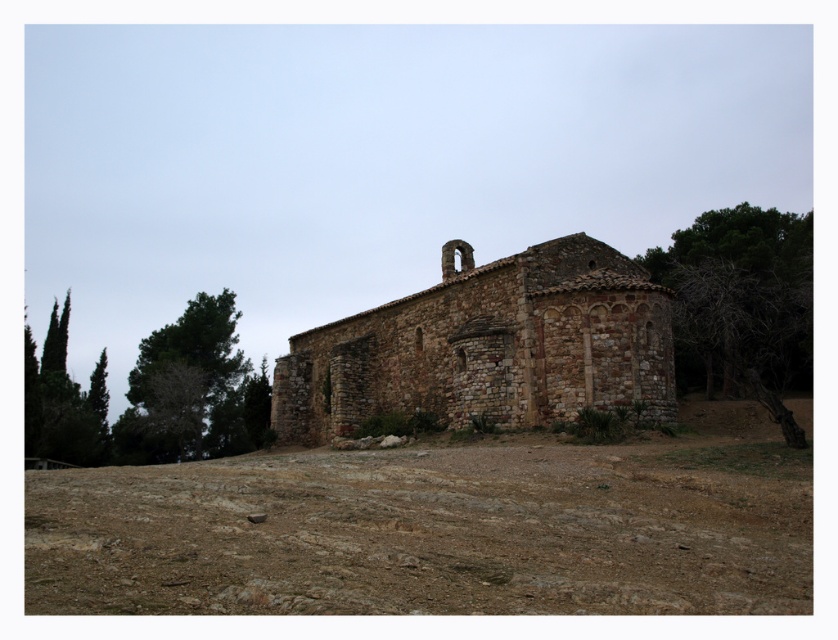
From the picture: Does brown gravelly dirt at lower center appear over bare wood tree at right?

No, brown gravelly dirt at lower center is not above bare wood tree at right.

Consider the image. Does brown gravelly dirt at lower center have a larger size compared to bare wood tree at right?

Actually, brown gravelly dirt at lower center might be smaller than bare wood tree at right.

Is point (640, 508) closer to viewer compared to point (795, 284)?

Yes, point (640, 508) is in front of point (795, 284).

What are the coordinates of `brown gravelly dirt at lower center` in the screenshot? It's located at (438, 529).

Does brown gravelly dirt at lower center appear on the left side of green leafy tree at left?

Incorrect, brown gravelly dirt at lower center is not on the left side of green leafy tree at left.

Consider the image. Is brown gravelly dirt at lower center to the right of green leafy tree at left from the viewer's perspective?

Correct, you'll find brown gravelly dirt at lower center to the right of green leafy tree at left.

Locate an element on the screen. The image size is (838, 640). brown gravelly dirt at lower center is located at coordinates (438, 529).

Is brown stone church at center to the left of bare wood tree at right from the viewer's perspective?

Indeed, brown stone church at center is positioned on the left side of bare wood tree at right.

Is brown stone church at center smaller than bare wood tree at right?

Indeed, brown stone church at center has a smaller size compared to bare wood tree at right.

Which is behind, point (518, 296) or point (804, 445)?

The point (518, 296) is more distant.

What are the coordinates of `brown stone church at center` in the screenshot? It's located at (489, 346).